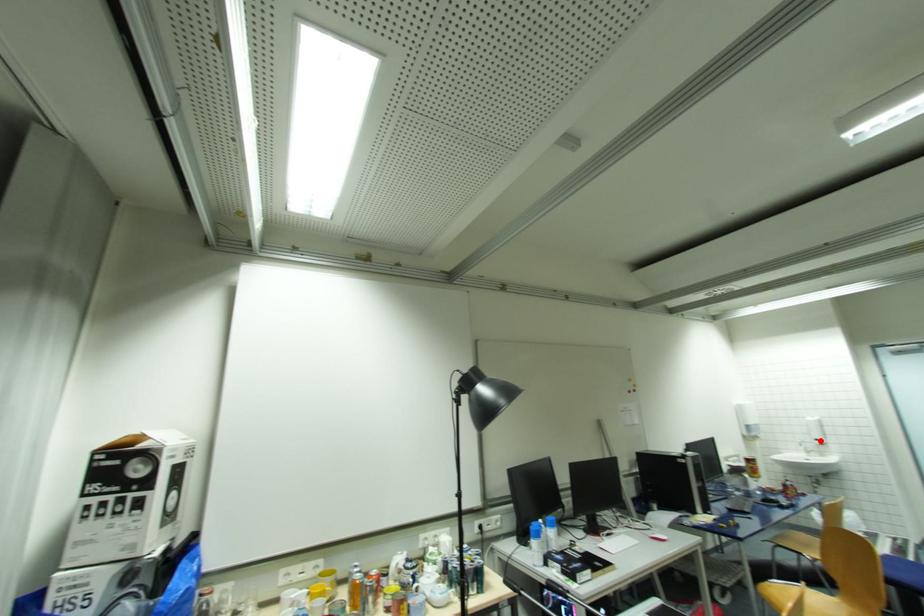
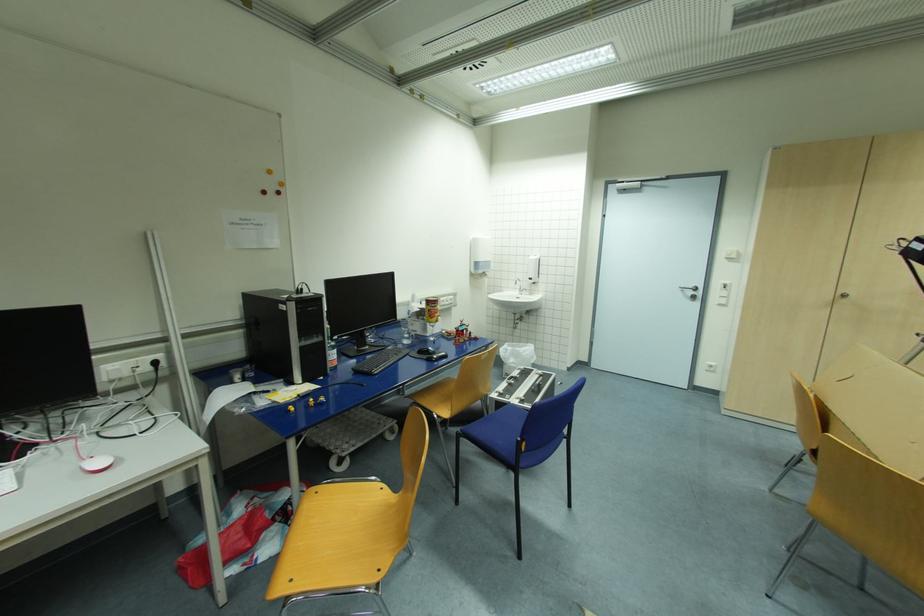
The point at the highlighted location is marked in the first image. Where is the corresponding point in the second image?

(533, 280)